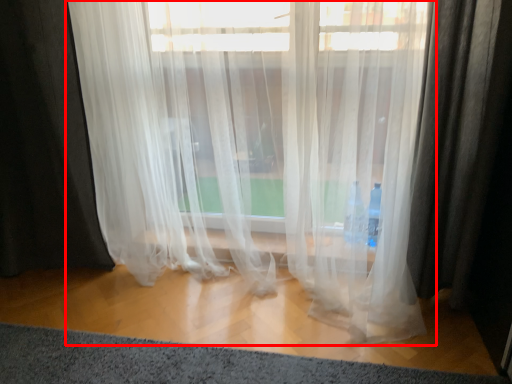
Question: Where is curtain (annotated by the red box) located in relation to doormat in the image?

Choices:
 (A) right
 (B) left

Answer: (A)